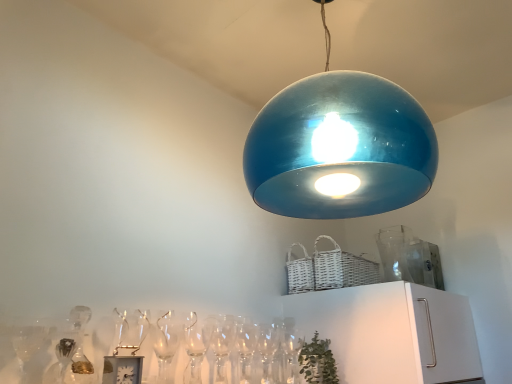
Question: Is glossy blue dome at upper center in front of or behind green leafy plant at lower center in the image?

Choices:
 (A) front
 (B) behind

Answer: (A)

Question: From a real-world perspective, is glossy blue dome at upper center positioned above or below green leafy plant at lower center?

Choices:
 (A) above
 (B) below

Answer: (A)

Question: Considering the real-world distances, which object is farthest from the white wicker basket at upper right?

Choices:
 (A) clear glass wine glass at lower center
 (B) glossy blue dome at upper center
 (C) green leafy plant at lower center

Answer: (A)

Question: Which is nearer to the green leafy plant at lower center?

Choices:
 (A) white wicker basket at upper right
 (B) glossy blue dome at upper center
 (C) clear glass wine glass at lower center

Answer: (A)